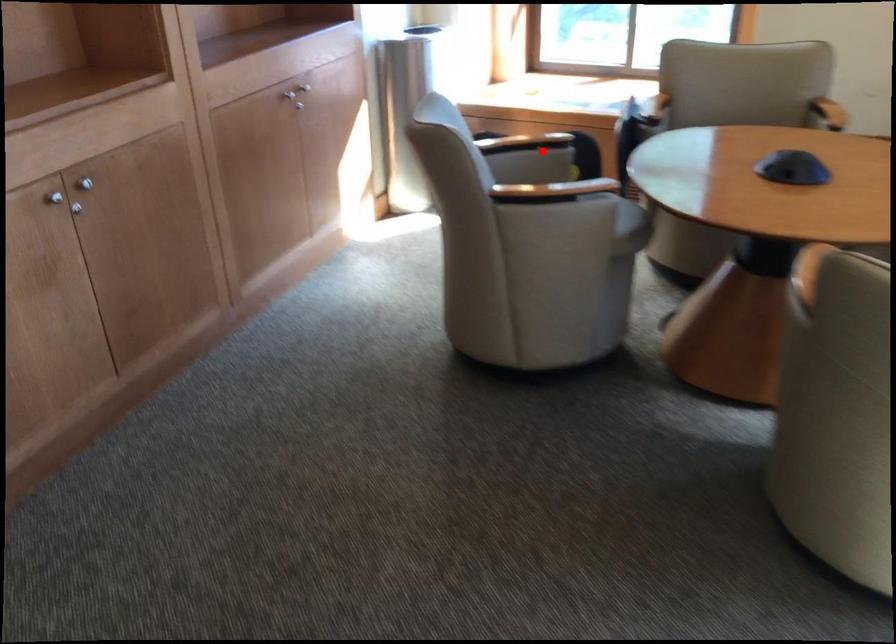
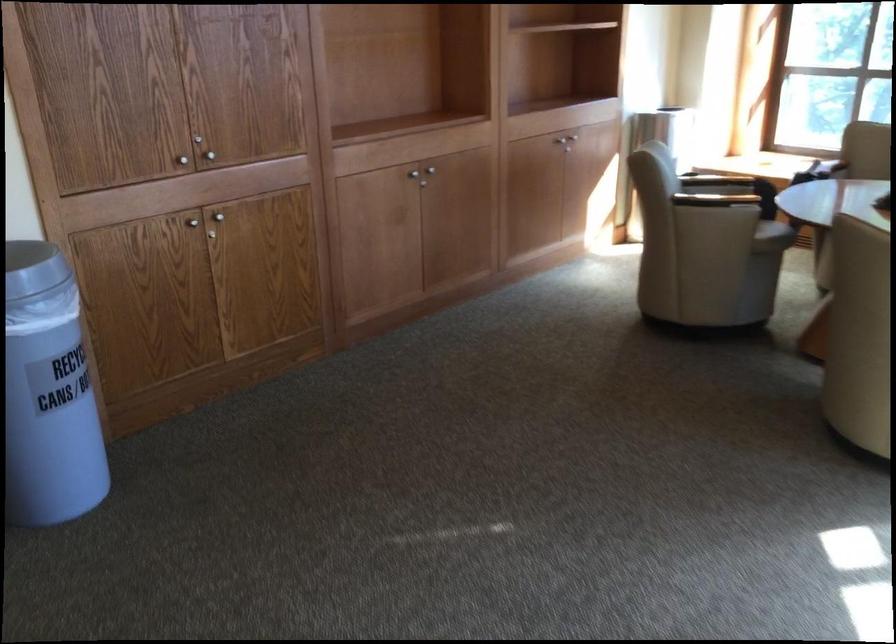
Locate, in the second image, the point that corresponds to the highlighted location in the first image.

(731, 178)